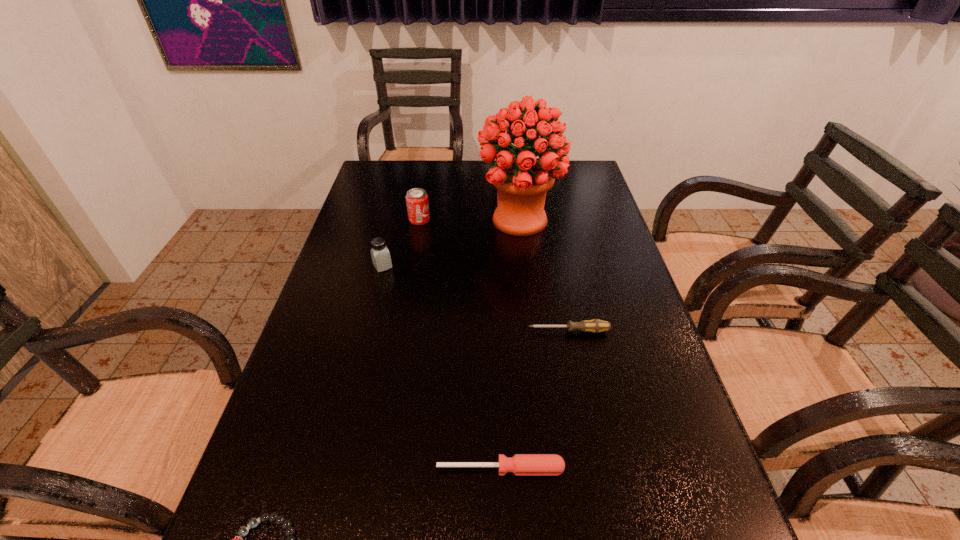
This screenshot has height=540, width=960. What are the coordinates of `the tallest object` in the screenshot? It's located at (522, 180).

Locate an element on the screen. the third object from left to right is located at coordinates (417, 202).

Where is `saltshaker`? This screenshot has width=960, height=540. saltshaker is located at coordinates (381, 259).

Where is `the farther screwdriver`? The height and width of the screenshot is (540, 960). the farther screwdriver is located at coordinates (595, 325).

At what (x,y) coordinates should I click in order to perform the action: click on the fifth farthest object. Please return your answer as a coordinate pair (x, y). Looking at the image, I should click on (520, 464).

Image resolution: width=960 pixels, height=540 pixels. Find the location of `free space located on the front of the tallest object`. free space located on the front of the tallest object is located at coordinates (525, 275).

This screenshot has height=540, width=960. Identify the location of vacant space located on the right of the fourth object from right to left. click(477, 220).

Where is `free space located on the back of the fourth nearest object`? free space located on the back of the fourth nearest object is located at coordinates (390, 239).

The height and width of the screenshot is (540, 960). I want to click on vacant space located at the tip of the farther screwdriver, so click(x=420, y=331).

You are a GUI agent. You are given a task and a screenshot of the screen. Output one action in this format:
    pyautogui.click(x=<x>, y=<y>)
    Task: Click on the blank space located 0.350m at the tip of the farther screwdriver
    The width and height of the screenshot is (960, 540).
    Given the screenshot: What is the action you would take?
    pyautogui.click(x=383, y=331)